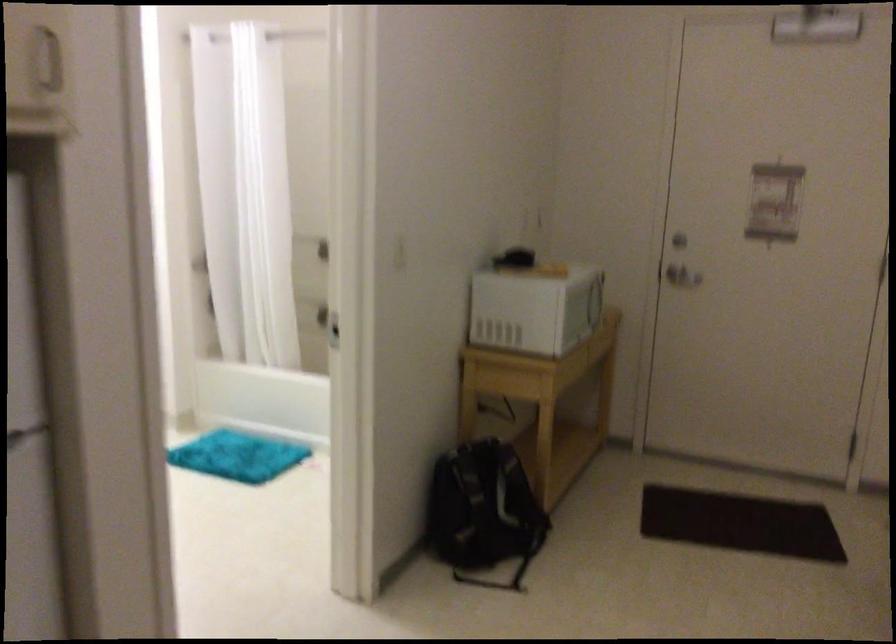
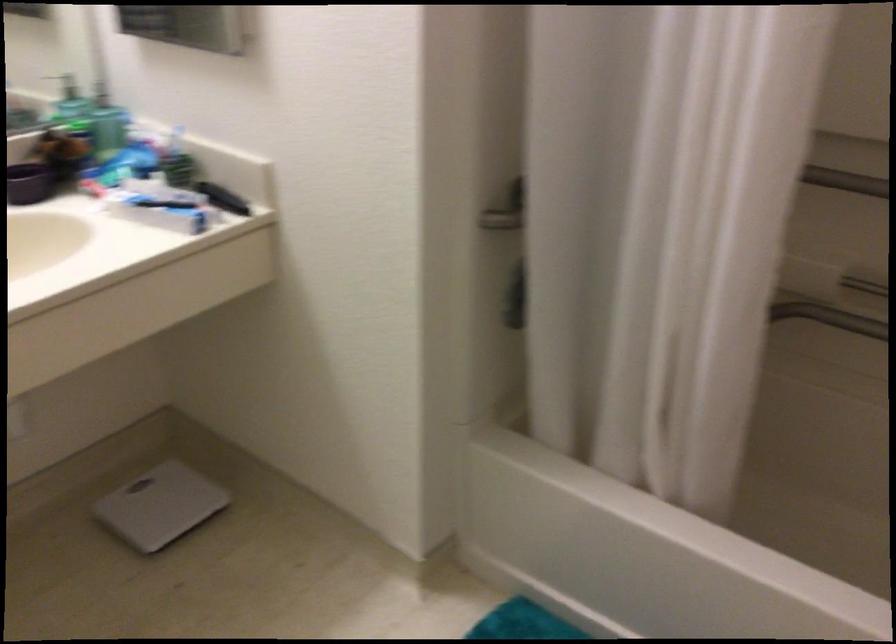
Question: I am providing you with two images of the same scene from different viewpoints. After the viewpoint changes to image2, which objects are now occluded?

Choices:
 (A) white bathroom scale
 (B) shower faucet handle
 (C) black round pan
 (D) dispenser pump

Answer: (B)